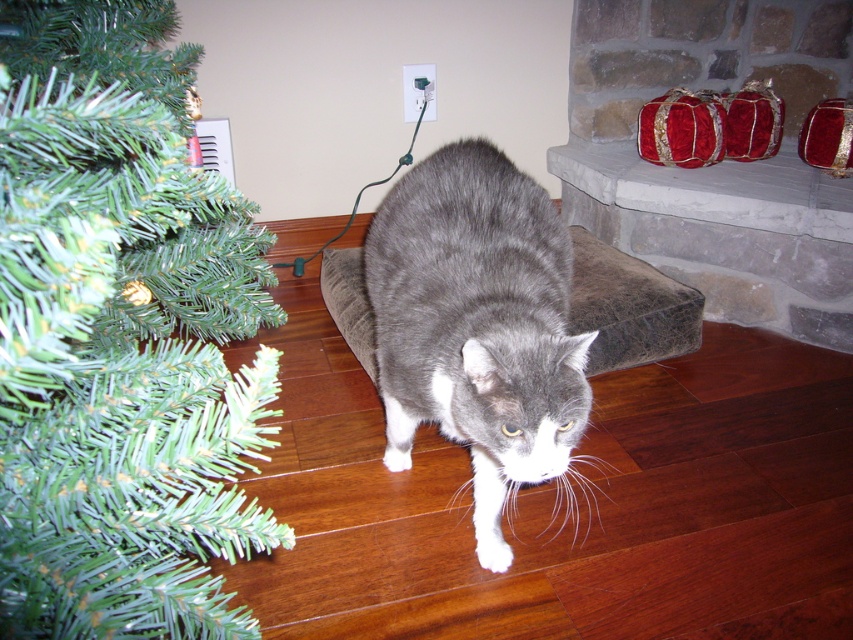
Question: Does green artificial at left appear under gray fur cat at center?

Choices:
 (A) yes
 (B) no

Answer: (A)

Question: Is green artificial at left wider than gray fur cat at center?

Choices:
 (A) no
 (B) yes

Answer: (B)

Question: Is green artificial at left positioned at the back of gray fur cat at center?

Choices:
 (A) yes
 (B) no

Answer: (B)

Question: Which point is closer to the camera taking this photo?

Choices:
 (A) (473, 426)
 (B) (106, 284)

Answer: (B)

Question: Among these objects, which one is nearest to the camera?

Choices:
 (A) gray fur cat at center
 (B) green artificial at left

Answer: (B)

Question: Which object appears closest to the camera in this image?

Choices:
 (A) green artificial at left
 (B) gray fur cat at center

Answer: (A)